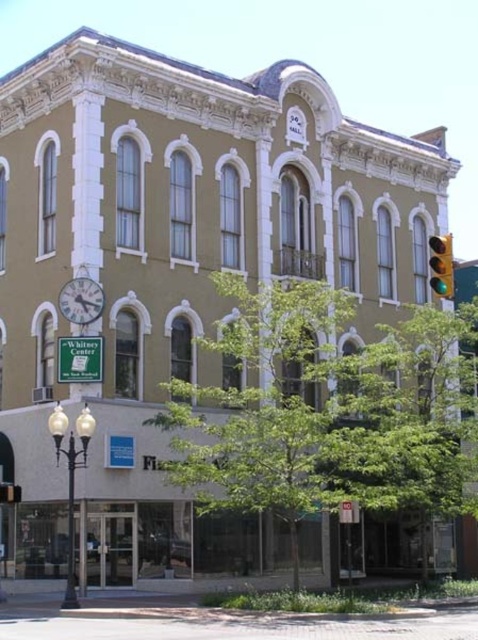
Is metallic silver clock at upper left positioned behind green glass traffic light at right?

That is True.

Can you confirm if metallic silver clock at upper left is shorter than green glass traffic light at right?

Yes, metallic silver clock at upper left is shorter than green glass traffic light at right.

This screenshot has width=478, height=640. In order to click on metallic silver clock at upper left in this screenshot , I will do 80,300.

Where is `metallic silver clock at upper left`? The height and width of the screenshot is (640, 478). metallic silver clock at upper left is located at coordinates (80, 300).